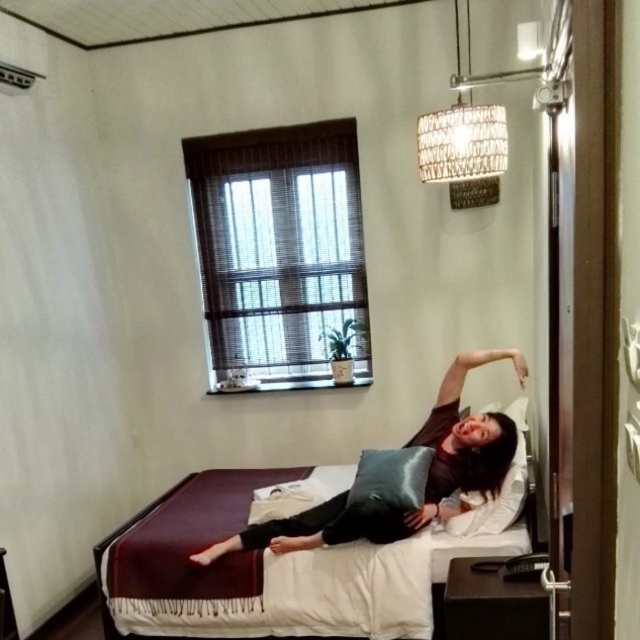
Can you confirm if dark brown leather pillow at center is positioned to the left of silky black pillow at center?

Indeed, dark brown leather pillow at center is positioned on the left side of silky black pillow at center.

Between dark brown leather pillow at center and silky black pillow at center, which one is positioned lower?

dark brown leather pillow at center is lower down.

The image size is (640, 640). What do you see at coordinates (426, 480) in the screenshot?
I see `dark brown leather pillow at center` at bounding box center [426, 480].

This screenshot has width=640, height=640. Find the location of `dark brown leather pillow at center`. dark brown leather pillow at center is located at coordinates (426, 480).

Based on the photo, measure the distance from maroon fabric bed at center to silky black pillow at center.

maroon fabric bed at center and silky black pillow at center are 19.22 inches apart from each other.

Does maroon fabric bed at center have a greater width compared to silky black pillow at center?

Correct, the width of maroon fabric bed at center exceeds that of silky black pillow at center.

Between point (148, 554) and point (392, 484), which one is positioned in front?

Point (392, 484) is in front.

Locate an element on the screen. The height and width of the screenshot is (640, 640). maroon fabric bed at center is located at coordinates (289, 561).

Measure the distance between maroon fabric bed at center and camera.

maroon fabric bed at center is 2.61 meters from camera.

Can you confirm if maroon fabric bed at center is positioned above dark brown leather pillow at center?

No.

Who is more forward, (273, 608) or (470, 417)?

Positioned in front is point (273, 608).

The width and height of the screenshot is (640, 640). Find the location of `maroon fabric bed at center`. maroon fabric bed at center is located at coordinates (289, 561).